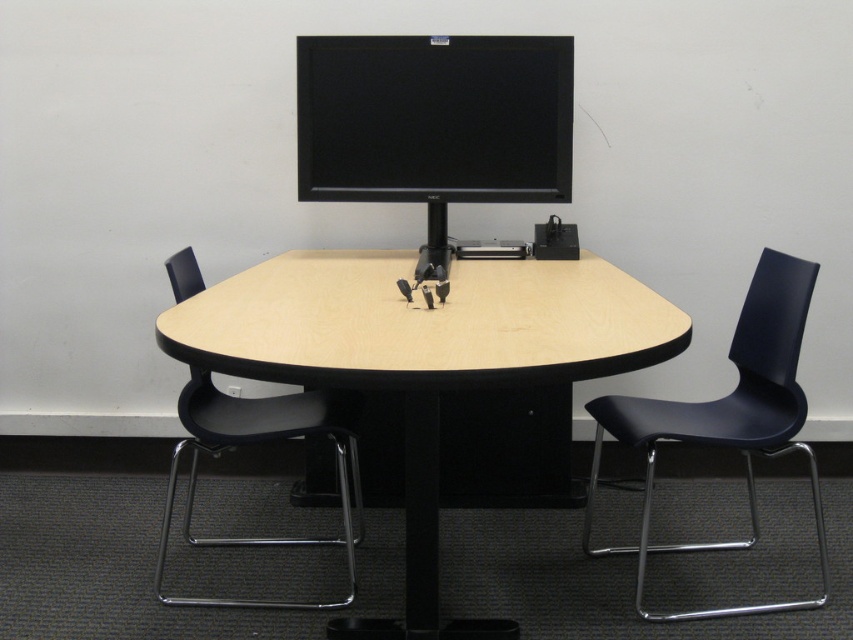
Question: Which object is the closest to the black matte monitor at upper center?

Choices:
 (A) black plastic swivel chair at lower left
 (B) light wood/black plastic computer desk at center

Answer: (B)

Question: Among these objects, which one is nearest to the camera?

Choices:
 (A) black plastic swivel chair at lower left
 (B) black plastic chair at right
 (C) black matte monitor at upper center
 (D) light wood/black plastic computer desk at center

Answer: (D)

Question: Does light wood/black plastic computer desk at center appear under black plastic swivel chair at lower left?

Choices:
 (A) yes
 (B) no

Answer: (B)

Question: Considering the relative positions of black plastic chair at right and black plastic swivel chair at lower left in the image provided, where is black plastic chair at right located with respect to black plastic swivel chair at lower left?

Choices:
 (A) right
 (B) left

Answer: (A)

Question: Does light wood/black plastic computer desk at center appear on the right side of black plastic swivel chair at lower left?

Choices:
 (A) yes
 (B) no

Answer: (A)

Question: Which point is farther to the camera?

Choices:
 (A) (166, 268)
 (B) (421, 525)
 (C) (666, 419)

Answer: (A)